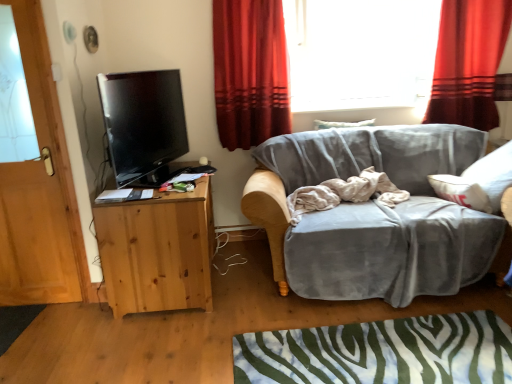
Locate an element on the screen. The image size is (512, 384). empty space that is to the right of wooden door at left is located at coordinates (80, 316).